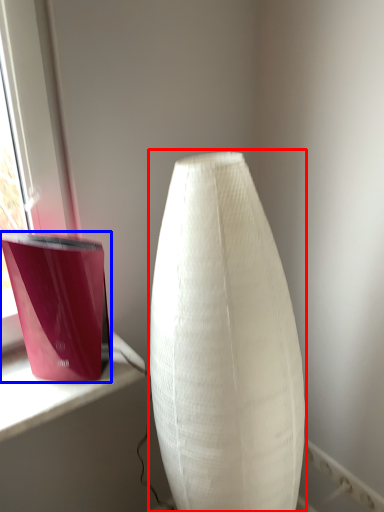
Question: Which point is closer to the camera, lamp (highlighted by a red box) or candle holder (highlighted by a blue box)?

Choices:
 (A) lamp
 (B) candle holder

Answer: (A)